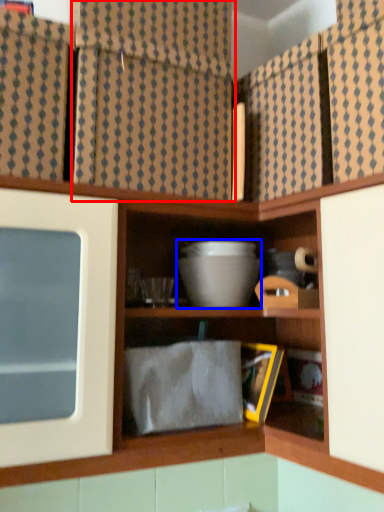
Question: Which object is closer to the camera taking this photo, curtain (highlighted by a red box) or mixing bowl (highlighted by a blue box)?

Choices:
 (A) curtain
 (B) mixing bowl

Answer: (A)